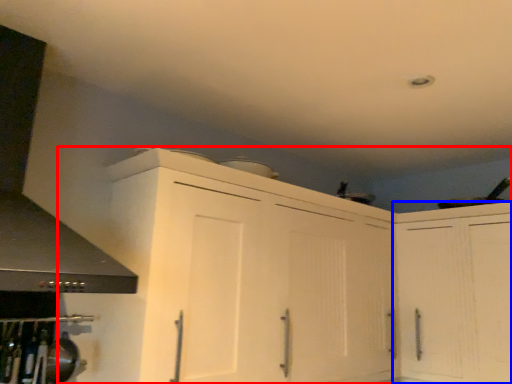
Question: Which of the following is the farthest to the observer, cabinetry (highlighted by a red box) or cabinetry (highlighted by a blue box)?

Choices:
 (A) cabinetry
 (B) cabinetry

Answer: (B)